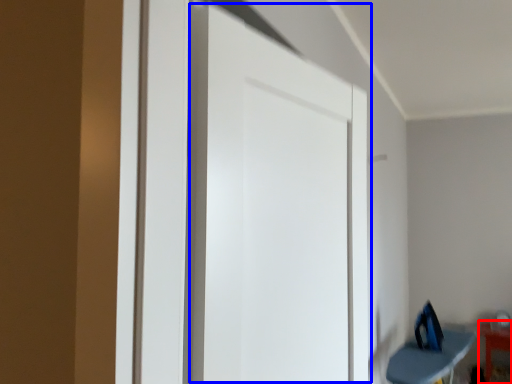
Question: Which point is further to the camera, furniture (highlighted by a red box) or door (highlighted by a blue box)?

Choices:
 (A) furniture
 (B) door

Answer: (A)